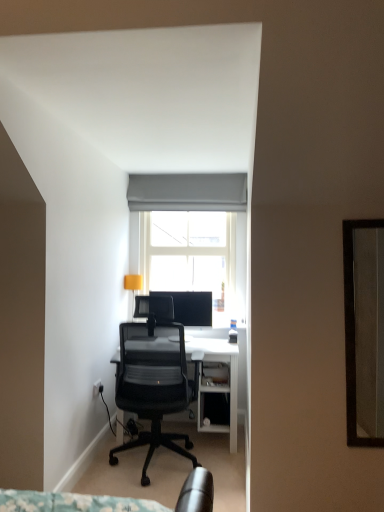
Where is `matte yellow lampshade at upper left`? This screenshot has height=512, width=384. matte yellow lampshade at upper left is located at coordinates pos(133,283).

Locate an element on the screen. This screenshot has height=512, width=384. black mesh office chair at center is located at coordinates (152, 386).

Find the location of a particular element. Image resolution: width=384 pixels, height=512 pixels. matte black monitor at center is located at coordinates (190, 307).

Choose the correct answer: Is gray fabric curtain at upper center inside white glass window at center or outside it?

gray fabric curtain at upper center is not enclosed by white glass window at center.

Is gray fabric curtain at upper center closer to the viewer compared to white glass window at center?

Yes, it is.

Where is `window on the right of gray fabric curtain at upper center`? window on the right of gray fabric curtain at upper center is located at coordinates (190, 237).

Is white glass window at center far away from matte black monitor at center?

Actually, white glass window at center and matte black monitor at center are a little close together.

Can we say white glass window at center lies outside matte black monitor at center?

Yes.

Considering the relative sizes of white glass window at center and matte black monitor at center in the image provided, is white glass window at center wider than matte black monitor at center?

Indeed, white glass window at center has a greater width compared to matte black monitor at center.

How different are the orientations of white glass window at center and matte black monitor at center in degrees?

The facing directions of white glass window at center and matte black monitor at center are 2.1 degrees apart.

Is white glass window at center not within black mesh office chair at center?

Yes, white glass window at center is located beyond the bounds of black mesh office chair at center.

Is white glass window at center to the left or to the right of black mesh office chair at center in the image?

white glass window at center is positioned on black mesh office chair at center's right side.

Which is correct: gray fabric curtain at upper center is inside matte black monitor at center, or outside of it?

The correct answer is: outside.

Between point (210, 206) and point (191, 291), which one is positioned behind?

Positioned behind is point (191, 291).

Considering the relative positions of gray fabric curtain at upper center and matte black monitor at center in the image provided, is gray fabric curtain at upper center to the right of matte black monitor at center from the viewer's perspective?

Indeed, gray fabric curtain at upper center is positioned on the right side of matte black monitor at center.

Considering the relative sizes of gray fabric curtain at upper center and matte black monitor at center in the image provided, is gray fabric curtain at upper center shorter than matte black monitor at center?

Correct, gray fabric curtain at upper center is not as tall as matte black monitor at center.

Is gray fabric curtain at upper center located within white glass window at center?

No, gray fabric curtain at upper center is not a part of white glass window at center.

Is white glass window at center smaller than gray fabric curtain at upper center?

Actually, white glass window at center might be larger than gray fabric curtain at upper center.

Looking at this image, can you confirm if white glass window at center is shorter than gray fabric curtain at upper center?

No, white glass window at center is not shorter than gray fabric curtain at upper center.

From a real-world perspective, is white glass window at center under gray fabric curtain at upper center?

Correct, in the physical world, white glass window at center is lower than gray fabric curtain at upper center.

Looking at the image, does gray fabric curtain at upper center seem bigger or smaller compared to matte yellow lampshade at upper left?

gray fabric curtain at upper center is bigger than matte yellow lampshade at upper left.

From a real-world perspective, is gray fabric curtain at upper center physically above matte yellow lampshade at upper left?

Yes, from a real-world perspective, gray fabric curtain at upper center is on top of matte yellow lampshade at upper left.

How different are the orientations of gray fabric curtain at upper center and matte yellow lampshade at upper left in degrees?

The facing directions of gray fabric curtain at upper center and matte yellow lampshade at upper left are 1.34 degrees apart.

From the image's perspective, is gray fabric curtain at upper center above or below matte yellow lampshade at upper left?

Based on their image positions, gray fabric curtain at upper center is located above matte yellow lampshade at upper left.

In the image, is matte yellow lampshade at upper left on the left side or the right side of matte black monitor at center?

matte yellow lampshade at upper left is positioned on matte black monitor at center's left side.

Does point (125, 275) appear closer or farther from the camera than point (200, 297)?

Point (125, 275) appears to be farther away from the viewer than point (200, 297).

Consider the image. From a real-world perspective, is matte yellow lampshade at upper left physically located above or below matte black monitor at center?

In terms of real-world spatial position, matte yellow lampshade at upper left is above matte black monitor at center.

Locate an element on the screen. window lying below the gray fabric curtain at upper center (from the image's perspective) is located at coordinates (190, 237).

Locate an element on the screen. This screenshot has height=512, width=384. television on the left of white glass window at center is located at coordinates (190, 307).

Looking at the image, which one is located closer to black mesh office chair at center, white glass window at center or matte yellow lampshade at upper left?

Based on the image, matte yellow lampshade at upper left appears to be nearer to black mesh office chair at center.

Looking at the image, which one is located further to matte black monitor at center, black mesh office chair at center or matte yellow lampshade at upper left?

black mesh office chair at center.

Based on their spatial positions, is matte black monitor at center or gray fabric curtain at upper center closer to white glass window at center?

gray fabric curtain at upper center is closer to white glass window at center.

Looking at the image, which one is located closer to black mesh office chair at center, matte yellow lampshade at upper left or gray fabric curtain at upper center?

The object closer to black mesh office chair at center is matte yellow lampshade at upper left.

Estimate the real-world distances between objects in this image. Which object is closer to white glass window at center, matte yellow lampshade at upper left or black mesh office chair at center?

matte yellow lampshade at upper left.

Based on their spatial positions, is gray fabric curtain at upper center or matte yellow lampshade at upper left closer to matte black monitor at center?

matte yellow lampshade at upper left is positioned closer to the anchor matte black monitor at center.

From the image, which object appears to be nearer to matte yellow lampshade at upper left, black mesh office chair at center or white glass window at center?

The object closer to matte yellow lampshade at upper left is white glass window at center.

Considering their positions, is gray fabric curtain at upper center positioned further to black mesh office chair at center than matte black monitor at center?

Based on the image, gray fabric curtain at upper center appears to be further to black mesh office chair at center.

Where is `window between gray fabric curtain at upper center and matte yellow lampshade at upper left in the vertical direction`? window between gray fabric curtain at upper center and matte yellow lampshade at upper left in the vertical direction is located at coordinates (190, 237).

The width and height of the screenshot is (384, 512). What are the coordinates of `television positioned between black mesh office chair at center and matte yellow lampshade at upper left from near to far` in the screenshot? It's located at (190, 307).

At what (x,y) coordinates should I click in order to perform the action: click on television located between matte yellow lampshade at upper left and white glass window at center in the left-right direction. Please return your answer as a coordinate pair (x, y). This screenshot has height=512, width=384. Looking at the image, I should click on (190, 307).

Find the location of a particular element. lamp positioned between black mesh office chair at center and white glass window at center from near to far is located at coordinates (133, 283).